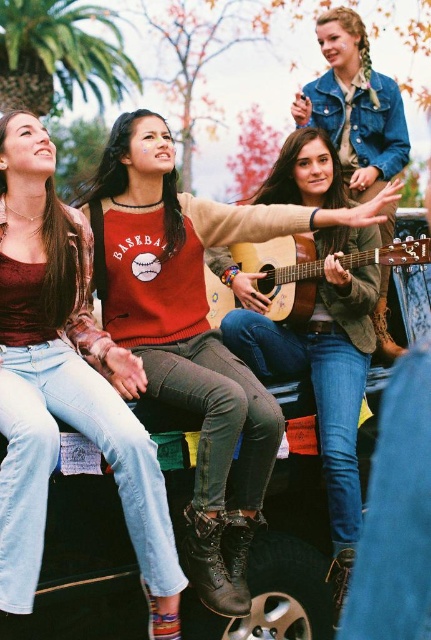
At what (x,y) coordinates should I click in order to perform the action: click on matte brown guitar at center. Please return your answer as a coordinate pair (x, y). The height and width of the screenshot is (640, 431). Looking at the image, I should click on coord(355,106).

Find the location of a particular element. This screenshot has height=640, width=431. matte brown guitar at center is located at coordinates (355, 106).

Image resolution: width=431 pixels, height=640 pixels. I want to click on matte brown guitar at center, so click(x=355, y=106).

Does point (34, 472) come closer to viewer compared to point (393, 145)?

Yes, point (34, 472) is in front of point (393, 145).

This screenshot has height=640, width=431. I want to click on matte red sweater at left, so click(63, 381).

The width and height of the screenshot is (431, 640). In order to click on matte red sweater at left in this screenshot , I will do `click(63, 381)`.

Is red sweater at center below acoustic wood guitar at center?

Yes, red sweater at center is below acoustic wood guitar at center.

Image resolution: width=431 pixels, height=640 pixels. I want to click on red sweater at center, so click(193, 332).